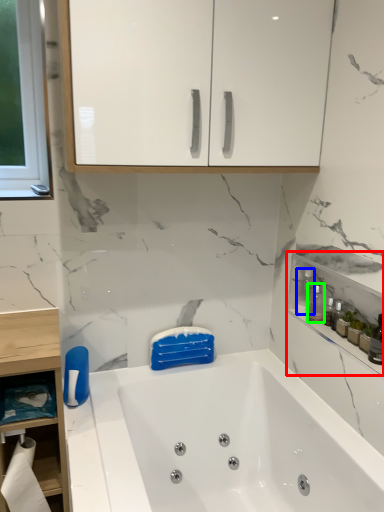
Question: Which object is positioned farthest from cabinetry (highlighted by a red box)? Select from bottle (highlighted by a blue box) and cleaning product (highlighted by a green box).

Choices:
 (A) bottle
 (B) cleaning product

Answer: (A)